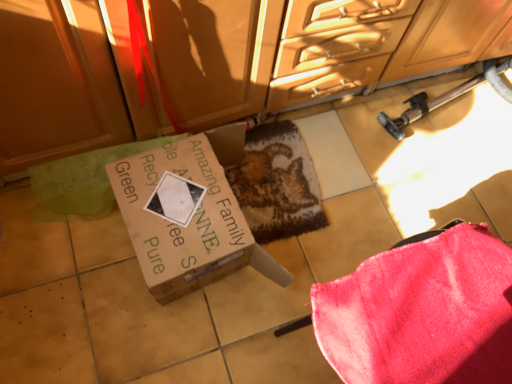
Where is `vacant space in front of textured brown mat at center`? vacant space in front of textured brown mat at center is located at coordinates (239, 306).